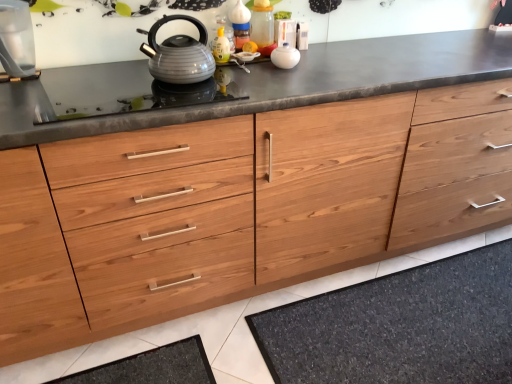
Locate an element on the screen. The width and height of the screenshot is (512, 384). empty space that is in between black glass gas stove at center and white glossy bowl at upper center, which is counted as the first appliance, starting from the right is located at coordinates (257, 72).